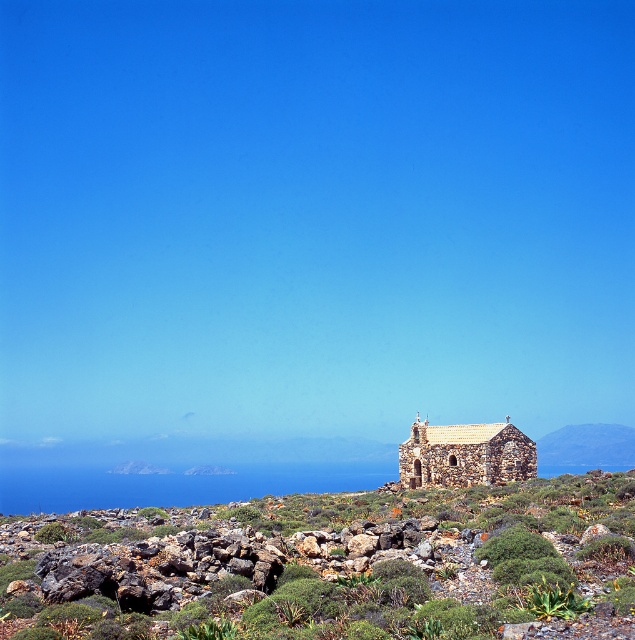
Who is more forward, (x=439, y=499) or (x=530, y=461)?

Positioned in front is point (x=439, y=499).

Does point (352, 536) lie in front of point (431, 433)?

Yes, point (352, 536) is in front of point (431, 433).

Between point (345, 625) and point (450, 481), which one is positioned in front?

Positioned in front is point (345, 625).

Where is `green mossy rocks at center`? Image resolution: width=635 pixels, height=640 pixels. green mossy rocks at center is located at coordinates (330, 564).